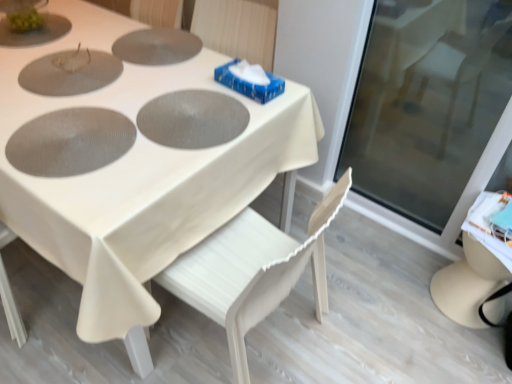
Question: Does white wood chair at center have a smaller size compared to matte gray pizza pan at center, which appears as the third pizza pan when viewed from the back?

Choices:
 (A) yes
 (B) no

Answer: (B)

Question: Is white wood chair at center taller than matte gray pizza pan at center, which is counted as the 1th pizza pan, starting from the front?

Choices:
 (A) yes
 (B) no

Answer: (A)

Question: From a real-world perspective, is white wood chair at center on matte gray pizza pan at center, which is counted as the 1th pizza pan, starting from the front?

Choices:
 (A) yes
 (B) no

Answer: (B)

Question: Is white wood chair at center wider than matte gray pizza pan at center, which is counted as the 1th pizza pan, starting from the front?

Choices:
 (A) no
 (B) yes

Answer: (B)

Question: From the image's perspective, is white wood chair at center above matte gray pizza pan at center, which appears as the third pizza pan when viewed from the back?

Choices:
 (A) yes
 (B) no

Answer: (B)

Question: Choose the correct answer: Is gray matte pizza pan at center, which is the second pizza pan in back-to-front order, inside matte gray pizza pan at center, which appears as the third pizza pan when viewed from the back, or outside it?

Choices:
 (A) outside
 (B) inside

Answer: (A)

Question: Looking at their shapes, would you say gray matte pizza pan at center, which is the second pizza pan in back-to-front order, is wider or thinner than matte gray pizza pan at center, which is counted as the 1th pizza pan, starting from the front?

Choices:
 (A) wide
 (B) thin

Answer: (B)

Question: In terms of size, does gray matte pizza pan at center, which is the second pizza pan from front to back, appear bigger or smaller than matte gray pizza pan at center, which is counted as the 1th pizza pan, starting from the front?

Choices:
 (A) small
 (B) big

Answer: (A)

Question: From the image's perspective, relative to matte gray pizza pan at center, which is counted as the 1th pizza pan, starting from the front, is gray matte pizza pan at center, which is the second pizza pan from front to back, above or below?

Choices:
 (A) below
 (B) above

Answer: (B)

Question: Is gray matte pizza pan at center, which is the second pizza pan from front to back, wider or thinner than white wood chair at center?

Choices:
 (A) thin
 (B) wide

Answer: (A)

Question: In the image, is gray matte pizza pan at center, which is the second pizza pan from front to back, positioned in front of or behind white wood chair at center?

Choices:
 (A) behind
 (B) front

Answer: (A)

Question: Considering the positions of gray matte pizza pan at center, which is the second pizza pan in back-to-front order, and white wood chair at center in the image, is gray matte pizza pan at center, which is the second pizza pan in back-to-front order, taller or shorter than white wood chair at center?

Choices:
 (A) short
 (B) tall

Answer: (A)

Question: Is gray matte pizza pan at center, which is the second pizza pan from front to back, inside the boundaries of white wood chair at center, or outside?

Choices:
 (A) outside
 (B) inside

Answer: (B)

Question: From the image's perspective, is matte gray pizza pan at center, which is counted as the 1th pizza pan, starting from the front, above or below white wood chair at center?

Choices:
 (A) above
 (B) below

Answer: (A)

Question: Considering the positions of matte gray pizza pan at center, which appears as the third pizza pan when viewed from the back, and white wood chair at center in the image, is matte gray pizza pan at center, which appears as the third pizza pan when viewed from the back, wider or thinner than white wood chair at center?

Choices:
 (A) wide
 (B) thin

Answer: (B)